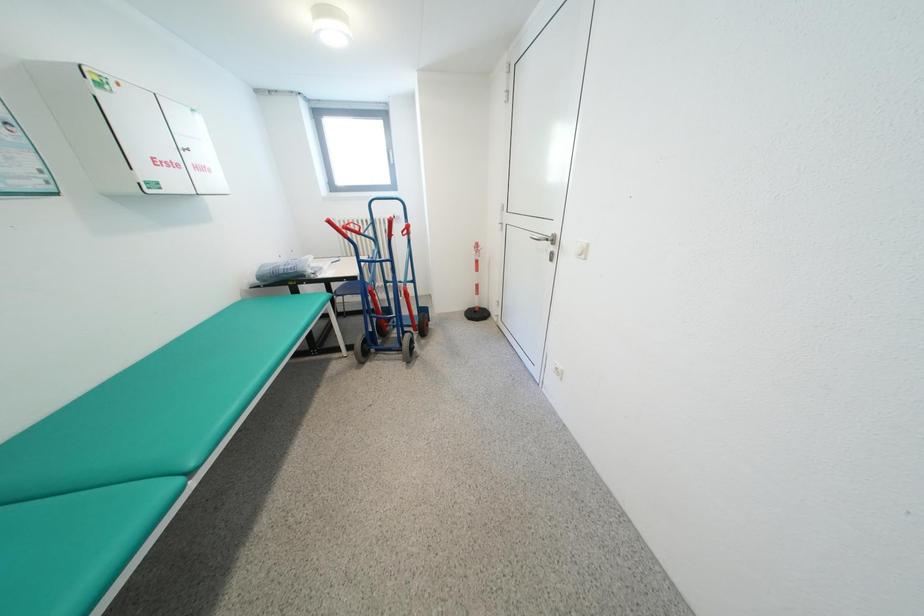
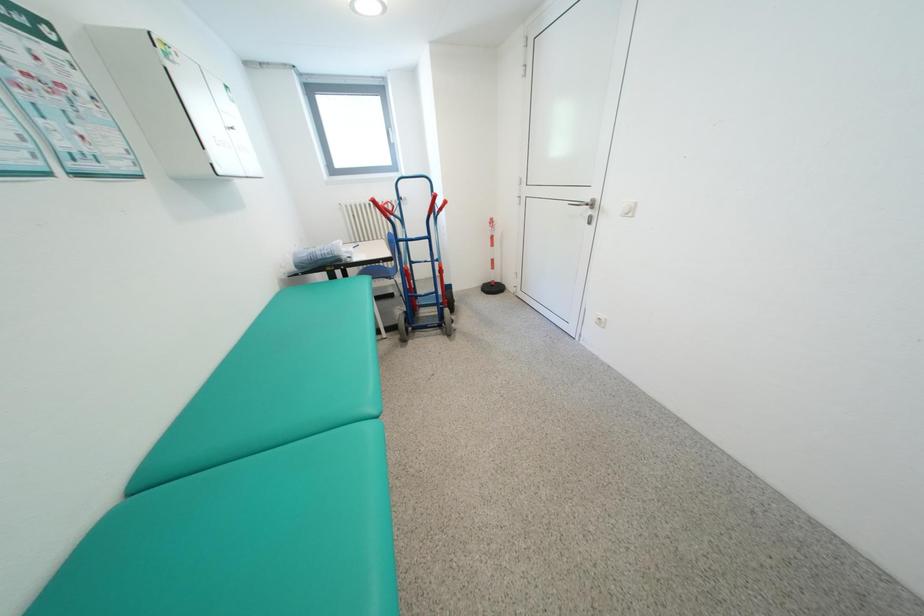
Question: The images are taken continuously from a first-person perspective. In which direction is your viewpoint rotating?

Choices:
 (A) Left
 (B) Right
 (C) Up
 (D) Down

Answer: (B)